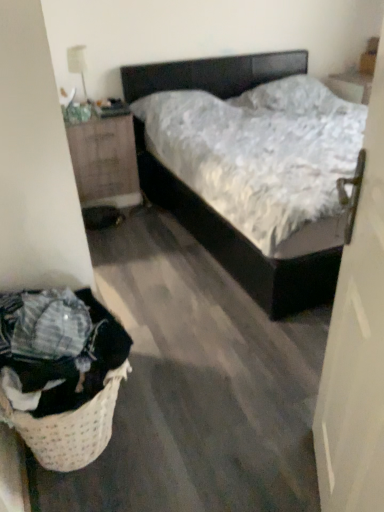
Locate an element on the screen. white matte door at right is located at coordinates (357, 344).

Describe the element at coordinates (61, 373) in the screenshot. The width and height of the screenshot is (384, 512). I see `woven beige laundry basket at lower left` at that location.

What do you see at coordinates (241, 246) in the screenshot?
I see `matte black bed at center` at bounding box center [241, 246].

The image size is (384, 512). What do you see at coordinates (78, 64) in the screenshot?
I see `white glossy lamp at upper left` at bounding box center [78, 64].

The height and width of the screenshot is (512, 384). What are the coordinates of `white matte door at right` in the screenshot? It's located at (357, 344).

Consider the image. Are wooden nightstand at left and white glossy lamp at upper left located far from each other?

That's not correct — wooden nightstand at left is a little close to white glossy lamp at upper left.

Considering the sizes of objects wooden nightstand at left and white glossy lamp at upper left in the image provided, who is smaller, wooden nightstand at left or white glossy lamp at upper left?

Smaller between the two is white glossy lamp at upper left.

From the image's perspective, is wooden nightstand at left located above white glossy lamp at upper left?

No, from the image's perspective, wooden nightstand at left is not above white glossy lamp at upper left.

Is wooden nightstand at left thinner than woven beige laundry basket at lower left?

No, wooden nightstand at left is not thinner than woven beige laundry basket at lower left.

Would you consider wooden nightstand at left to be distant from woven beige laundry basket at lower left?

Indeed, wooden nightstand at left is not near woven beige laundry basket at lower left.

Is wooden nightstand at left facing away from woven beige laundry basket at lower left?

No, wooden nightstand at left is not facing away from woven beige laundry basket at lower left.

From a real-world perspective, is wooden nightstand at left on top of woven beige laundry basket at lower left?

Correct, in the physical world, wooden nightstand at left is higher than woven beige laundry basket at lower left.

Is wooden nightstand at left at the back of white glossy lamp at upper left?

That's not correct — white glossy lamp at upper left is not looking away from wooden nightstand at left.

Which object is thinner, white glossy lamp at upper left or wooden nightstand at left?

Thinner between the two is white glossy lamp at upper left.

Considering the sizes of white glossy lamp at upper left and wooden nightstand at left in the image, is white glossy lamp at upper left taller or shorter than wooden nightstand at left?

Considering their sizes, white glossy lamp at upper left has less height than wooden nightstand at left.

Considering the sizes of objects white glossy lamp at upper left and wooden nightstand at left in the image provided, who is smaller, white glossy lamp at upper left or wooden nightstand at left?

With smaller size is white glossy lamp at upper left.

Is point (89, 197) closer or farther from the camera than point (374, 137)?

Point (89, 197) appears to be farther away from the viewer than point (374, 137).

Would you say wooden nightstand at left is outside white matte door at right?

wooden nightstand at left is positioned outside white matte door at right.

From the picture: What's the angular difference between wooden nightstand at left and white matte door at right's facing directions?

wooden nightstand at left and white matte door at right are facing 119 degrees away from each other.

Can you confirm if woven beige laundry basket at lower left is thinner than matte black bed at center?

Yes.

Is woven beige laundry basket at lower left next to matte black bed at center?

They are not placed beside each other.

Could you tell me if woven beige laundry basket at lower left is facing matte black bed at center?

No, woven beige laundry basket at lower left is not facing towards matte black bed at center.

From a real-world perspective, is white glossy lamp at upper left positioned over woven beige laundry basket at lower left based on gravity?

Yes.

Which object is further away from the camera taking this photo, white glossy lamp at upper left or woven beige laundry basket at lower left?

white glossy lamp at upper left is more distant.

Is white glossy lamp at upper left completely or partially outside of woven beige laundry basket at lower left?

Indeed, white glossy lamp at upper left is completely outside woven beige laundry basket at lower left.

How distant is white matte door at right from white glossy lamp at upper left?

The distance of white matte door at right from white glossy lamp at upper left is 2.67 meters.

Based on their sizes in the image, would you say white matte door at right is bigger or smaller than white glossy lamp at upper left?

In the image, white matte door at right appears to be larger than white glossy lamp at upper left.

Where is `lamp located behind the white matte door at right`? lamp located behind the white matte door at right is located at coordinates (78, 64).

The height and width of the screenshot is (512, 384). Identify the location of lamp located above the wooden nightstand at left (from a real-world perspective). (78, 64).

You are a GUI agent. You are given a task and a screenshot of the screen. Output one action in this format:
    pyautogui.click(x=<x>, y=<y>)
    Task: Click on the laundry basket that appears on the right of wooden nightstand at left
    
    Given the screenshot: What is the action you would take?
    pyautogui.click(x=61, y=373)

Looking at this image, estimate the real-world distances between objects in this image. Which object is further from wooden nightstand at left, white glossy lamp at upper left or woven beige laundry basket at lower left?

woven beige laundry basket at lower left is further to wooden nightstand at left.

From the image, which object appears to be nearer to matte black bed at center, wooden nightstand at left or white matte door at right?

wooden nightstand at left is positioned closer to the anchor matte black bed at center.

In the scene shown: Considering their positions, is white matte door at right positioned closer to matte black bed at center than woven beige laundry basket at lower left?

woven beige laundry basket at lower left lies closer to matte black bed at center than the other object.

From the image, which object appears to be farther from white matte door at right, woven beige laundry basket at lower left or wooden nightstand at left?

The object further to white matte door at right is wooden nightstand at left.

When comparing their distances from white glossy lamp at upper left, does white matte door at right or matte black bed at center seem further?

The object further to white glossy lamp at upper left is white matte door at right.

Which object lies further to the anchor point white glossy lamp at upper left, wooden nightstand at left or matte black bed at center?

Among the two, matte black bed at center is located further to white glossy lamp at upper left.

Which object lies nearer to the anchor point wooden nightstand at left, white glossy lamp at upper left or white matte door at right?

white glossy lamp at upper left lies closer to wooden nightstand at left than the other object.

Based on their spatial positions, is white matte door at right or matte black bed at center closer to wooden nightstand at left?

Based on the image, matte black bed at center appears to be nearer to wooden nightstand at left.

Locate an element on the screen. The width and height of the screenshot is (384, 512). bed positioned between white matte door at right and wooden nightstand at left from near to far is located at coordinates (241, 246).

Find the location of a particular element. nightstand located between white glossy lamp at upper left and matte black bed at center in the left-right direction is located at coordinates (105, 161).

Identify the location of door between matte black bed at center and woven beige laundry basket at lower left from top to bottom. The image size is (384, 512). tap(357, 344).

The height and width of the screenshot is (512, 384). Find the location of `laundry basket between white matte door at right and wooden nightstand at left in the front-back direction`. laundry basket between white matte door at right and wooden nightstand at left in the front-back direction is located at coordinates (61, 373).